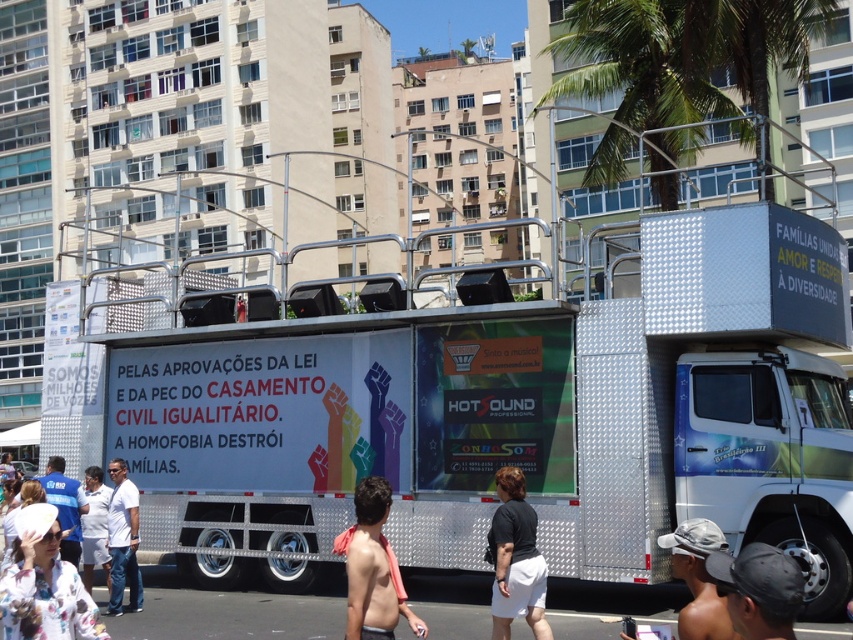
You are standing in front of the truck and want to take a photo. You notice two points marked on the truck. Which point, point [538,612] or point [64,525], is closer to your camera?

Point [538,612] is closer to the camera than point [64,525].

You are a photographer standing in the middle of the street. You want to take a photo of the green leafy palm tree at upper center and the black fabric cap at lower right. Which object will appear larger in the photo?

The green leafy palm tree at upper center will appear larger in the photo because it is much taller than the black fabric cap at lower right.